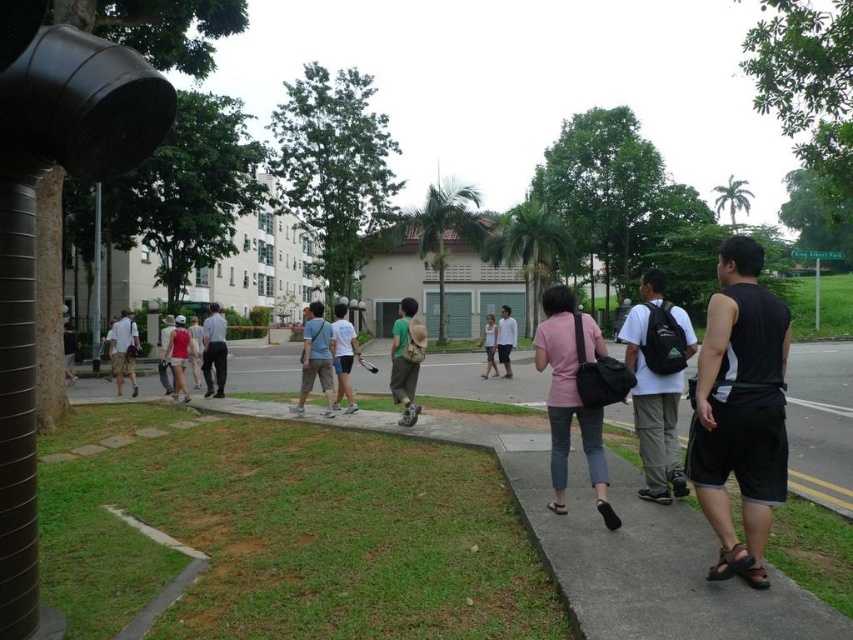
Question: Does green fabric backpack at center have a smaller size compared to light blue shirt at center?

Choices:
 (A) yes
 (B) no

Answer: (B)

Question: Is black matte shorts at right above green fabric backpack at center?

Choices:
 (A) no
 (B) yes

Answer: (A)

Question: Estimate the real-world distances between objects in this image. Which object is farther from the matte pink tank top at center?

Choices:
 (A) black matte shorts at right
 (B) white cotton shirt at center
 (C) pink fabric shirt at center

Answer: (A)

Question: Which point is farther from the camera taking this photo?

Choices:
 (A) (553, 316)
 (B) (639, 449)
 (C) (177, 333)
 (D) (508, 355)

Answer: (D)

Question: Which object appears closest to the camera in this image?

Choices:
 (A) matte pink tank top at center
 (B) light pink shirt at center

Answer: (A)

Question: Does white cotton shirt at center appear over matte pink tank top at center?

Choices:
 (A) yes
 (B) no

Answer: (A)